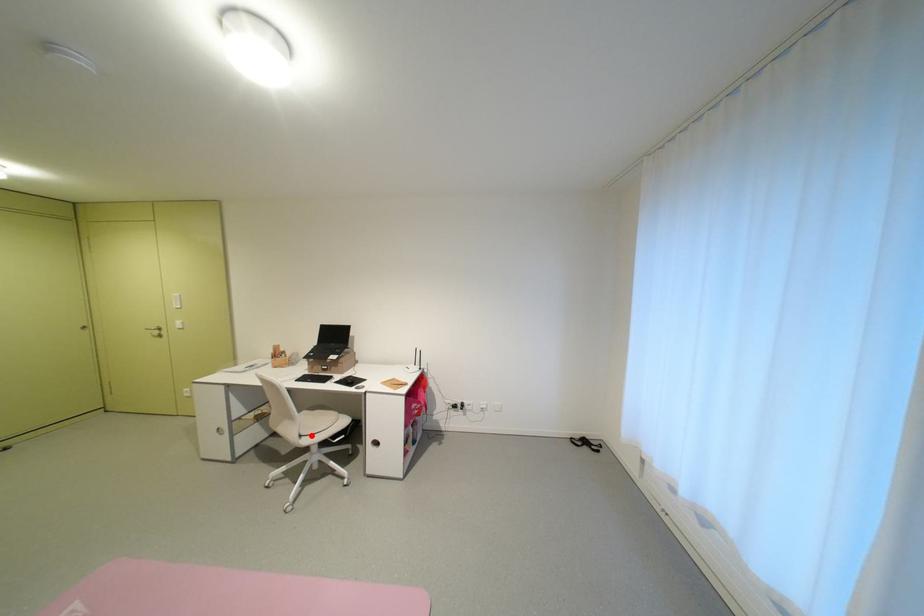
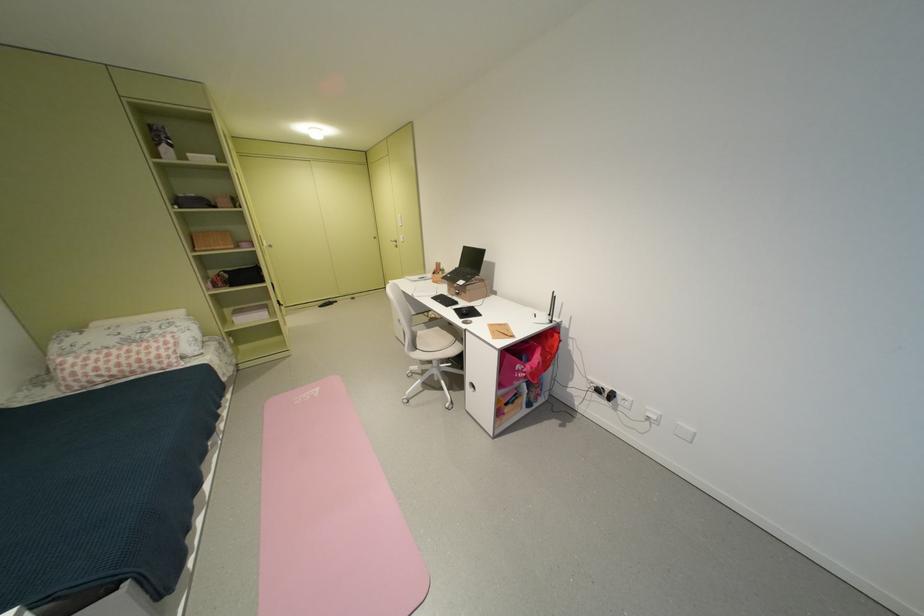
Locate, in the second image, the point that corresponds to the highlighted location in the first image.

(428, 349)